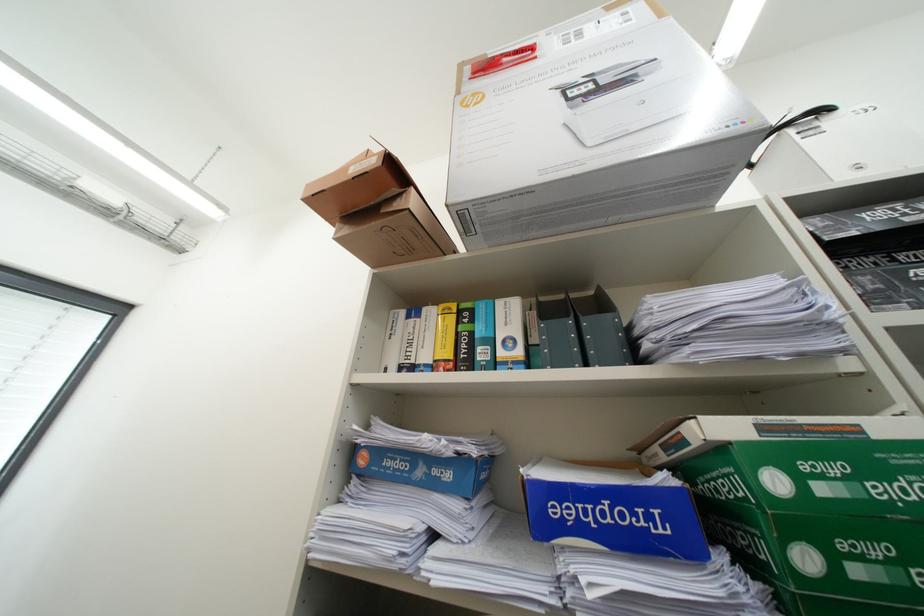
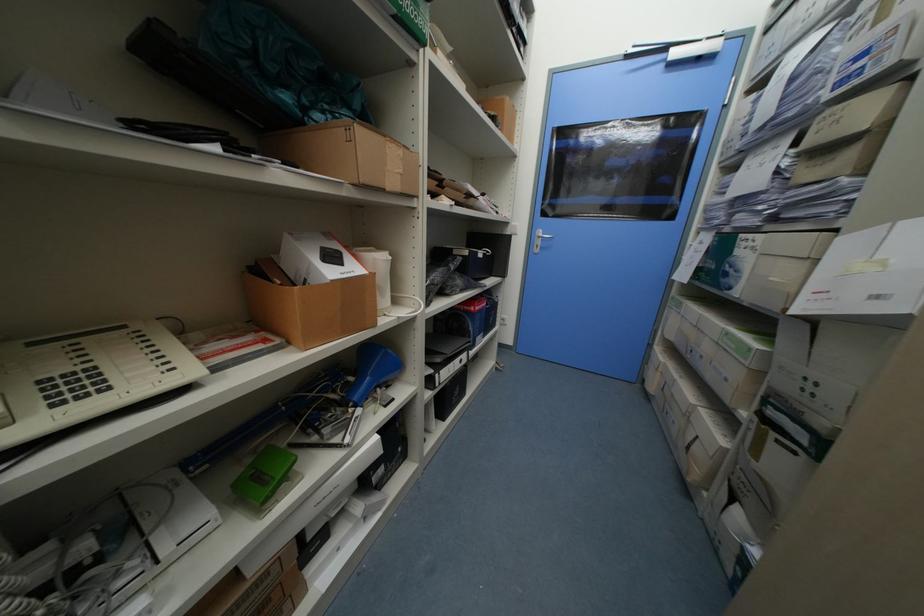
Based on the continuous images, in which direction is the camera rotating?

The camera rotated toward right-down.